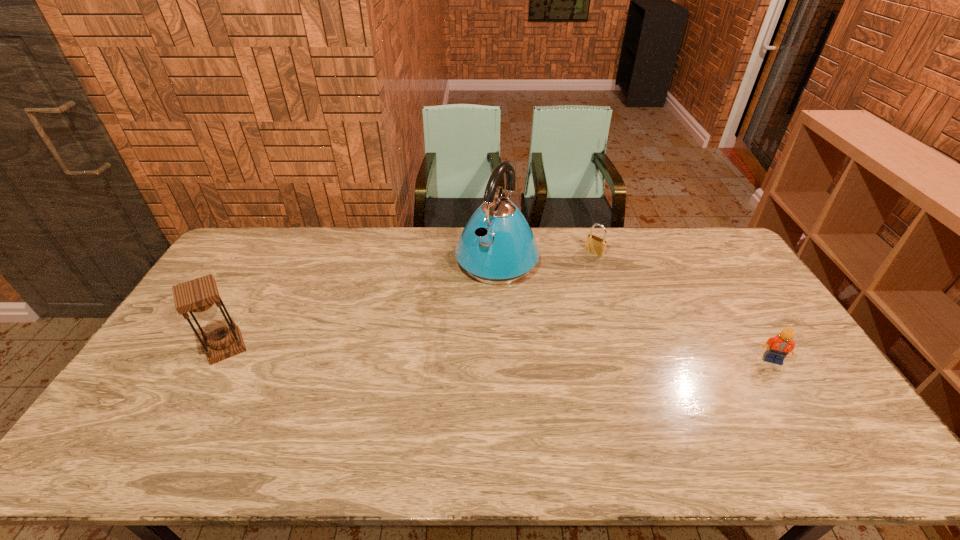
Identify the location of vacant space at the left edge of the desktop. This screenshot has width=960, height=540. (242, 288).

Locate an element on the screen. vacant space at the right edge of the desktop is located at coordinates (801, 363).

Identify the location of vacant position at the far left corner of the desktop. (276, 242).

Where is `vacant area at the far right corner of the desktop`? vacant area at the far right corner of the desktop is located at coordinates (718, 250).

Find the location of a particular element. Image resolution: width=960 pixels, height=540 pixels. free space between the kettle and the Lego is located at coordinates click(635, 310).

The image size is (960, 540). Find the location of `free space between the leftmost object and the third object from left to right`. free space between the leftmost object and the third object from left to right is located at coordinates (410, 300).

The image size is (960, 540). Find the location of `free space between the third object from left to right and the Lego`. free space between the third object from left to right and the Lego is located at coordinates (684, 306).

This screenshot has width=960, height=540. I want to click on vacant space that is in between the third object from right to left and the hourglass, so click(361, 303).

What are the coordinates of `vacant space that's between the Lego and the leftmost object` in the screenshot? It's located at (499, 353).

The image size is (960, 540). In order to click on free space between the padlock and the hourglass in this screenshot , I will do click(410, 300).